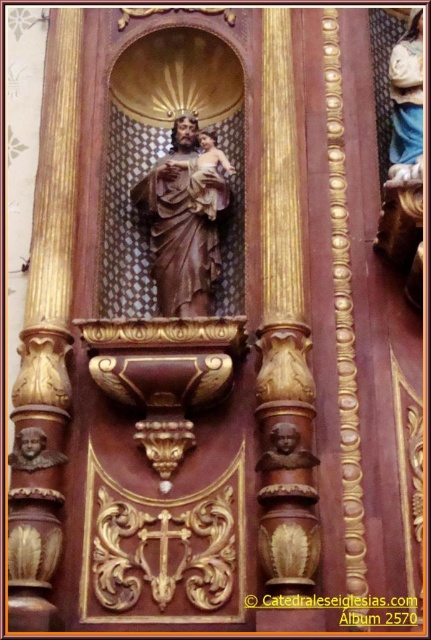
You are standing in the cathedral and want to take a closer look at the brown polished wood statue at center and the brown wood bust at center. Which one can you see more clearly from your current position?

The brown polished wood statue at center is closer to you than the brown wood bust at center, so you can see the brown polished wood statue at center more clearly from your current position.

You are standing in the center of the church and want to place a new candle holder exactly at the position of the brown polished wood statue at center. Is the point where you want to place the candle holder located at coordinate point [184,218]?

Yes, the brown polished wood statue at center is located at point [184,218], so placing the candle holder there would be at that coordinate.

Consider the image. You are an interior designer planning to place a new decorative item in the space. You have a small golden angel figurine that needs to be positioned near the brown polished wood statue at center and the matte brown bust at lower left. Based on their sizes, where would you place the golden angel figurine to ensure it doesn

The brown polished wood statue at center is larger than the matte brown bust at lower left. To maintain visual balance, place the golden angel figurine closer to the matte brown bust at lower left since it is smaller, ensuring the overall arrangement remains harmonious.